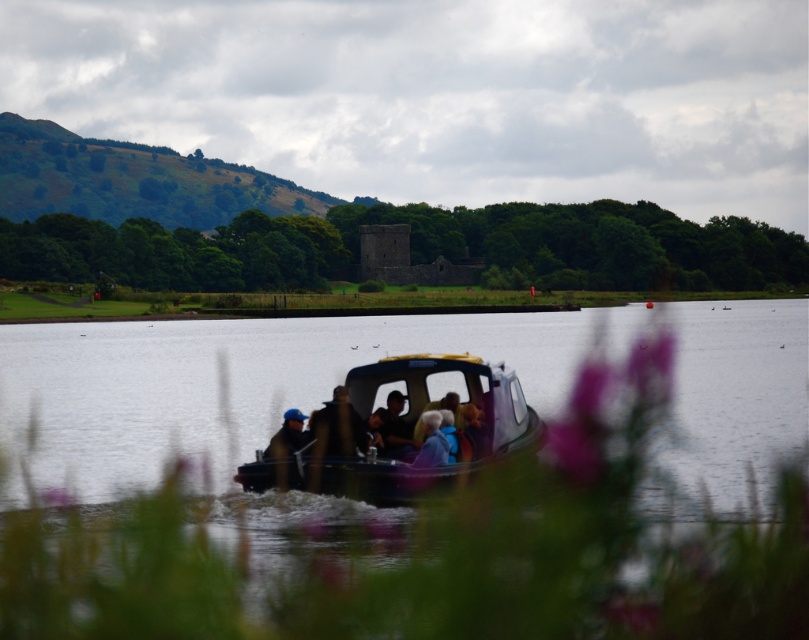
Does dark brown leather jacket at center have a greater width compared to blue fabric jacket at center?

No, dark brown leather jacket at center is not wider than blue fabric jacket at center.

Is point (392, 420) closer to camera compared to point (282, 444)?

That is False.

In order to click on dark brown leather jacket at center in this screenshot , I will do `click(392, 422)`.

Identify the location of dark brown leather jacket at center. Image resolution: width=809 pixels, height=640 pixels. (392, 422).

Who is more forward, (342, 410) or (299, 426)?

Point (342, 410) is in front.

Is point (350, 420) positioned behind point (289, 422)?

No, it is not.

You are a GUI agent. You are given a task and a screenshot of the screen. Output one action in this format:
    pyautogui.click(x=<x>, y=<y>)
    Task: Click on the brown leather jacket at center
    The image size is (809, 640).
    Given the screenshot: What is the action you would take?
    pyautogui.click(x=337, y=426)

Which is above, clear water at center or brown leather jacket at center?

Positioned higher is clear water at center.

Is the position of clear water at center more distant than that of brown leather jacket at center?

No, clear water at center is closer to the viewer.

Is point (159, 577) more distant than point (316, 410)?

No.

Find the location of a particular element. clear water at center is located at coordinates (477, 531).